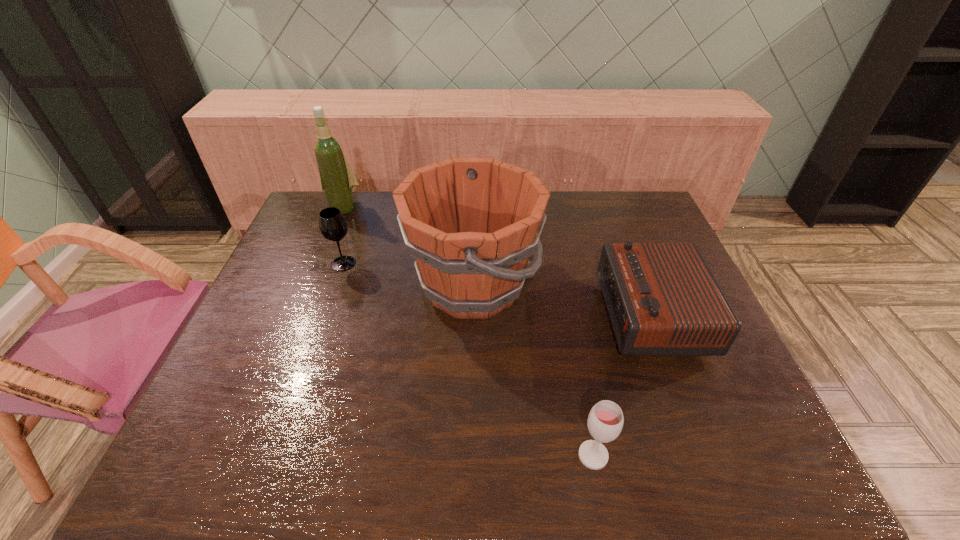
The height and width of the screenshot is (540, 960). I want to click on vacant region located on the back of the farther wineglass, so (350, 243).

Locate an element on the screen. free space located on the front panel of the rightmost object is located at coordinates (525, 315).

Identify the location of vacant space located on the front panel of the rightmost object. This screenshot has height=540, width=960. (547, 315).

This screenshot has height=540, width=960. In order to click on vacant space located on the front panel of the rightmost object in this screenshot , I will do `click(484, 315)`.

The height and width of the screenshot is (540, 960). Identify the location of free region located 0.130m on the right of the nearest object. (673, 455).

Locate an element on the screen. object located at the far edge is located at coordinates (337, 179).

Locate an element on the screen. The height and width of the screenshot is (540, 960). object located at the near edge is located at coordinates (605, 421).

The image size is (960, 540). I want to click on wine bottle at the left edge, so click(337, 179).

Locate an element on the screen. This screenshot has height=540, width=960. wineglass that is at the left edge is located at coordinates (332, 224).

Identify the location of object that is at the right edge. This screenshot has width=960, height=540. (662, 298).